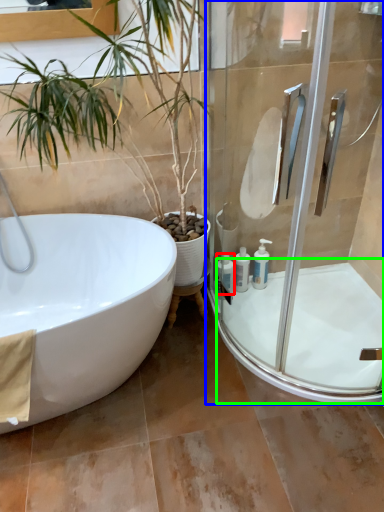
Question: Considering the real-world distances, which object is farthest from toiletry (highlighted by a red box)? shower door (highlighted by a blue box) or bath (highlighted by a green box)?

Choices:
 (A) shower door
 (B) bath

Answer: (A)